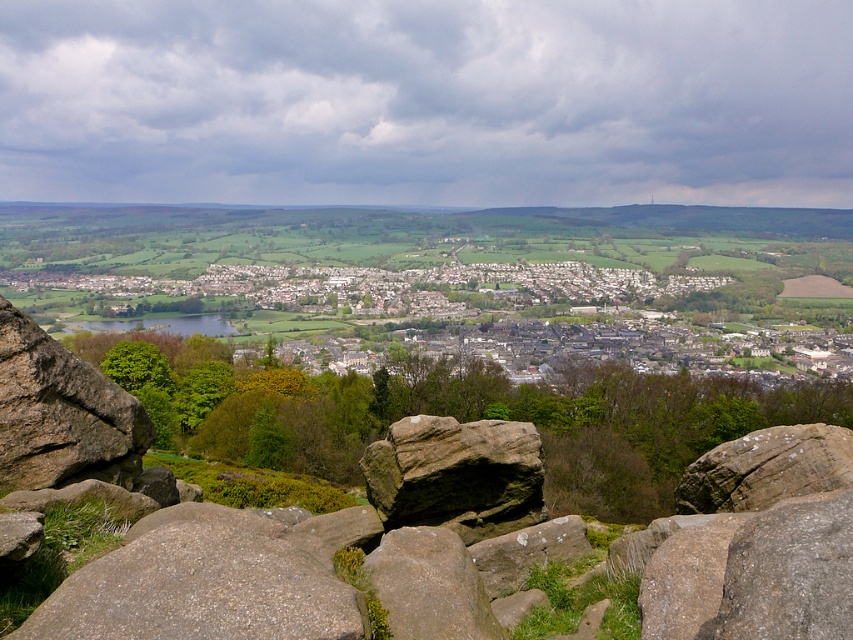
Who is positioned more to the left, white stone houses at center or brown rough rock at left?

white stone houses at center

From the picture: How much distance is there between white stone houses at center and brown rough rock at left?

455.05 meters

Where is `white stone houses at center`? The width and height of the screenshot is (853, 640). white stone houses at center is located at coordinates (479, 307).

Find the location of a particular element. The width and height of the screenshot is (853, 640). white stone houses at center is located at coordinates (479, 307).

Which of these two, brown rough rock at center or gray rough rock at center, stands shorter?

brown rough rock at center is shorter.

Can you confirm if brown rough rock at center is wider than gray rough rock at center?

Indeed, brown rough rock at center has a greater width compared to gray rough rock at center.

Is point (460, 472) more distant than point (807, 467)?

Yes.

I want to click on brown rough rock at center, so (x=456, y=474).

Does brown rough rock at left have a greater width compared to gray rough rock at center?

Incorrect, brown rough rock at left's width does not surpass gray rough rock at center's.

Does brown rough rock at left have a lesser width compared to gray rough rock at center?

Indeed, brown rough rock at left has a lesser width compared to gray rough rock at center.

Is point (42, 390) behind point (816, 433)?

No, (42, 390) is in front of (816, 433).

Where is `brown rough rock at left`? The width and height of the screenshot is (853, 640). brown rough rock at left is located at coordinates (61, 413).